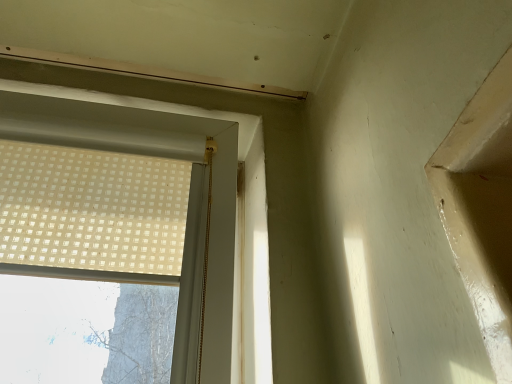
The height and width of the screenshot is (384, 512). What are the coordinates of `translucent plastic window at upper left` in the screenshot? It's located at (147, 155).

What do you see at coordinates (147, 155) in the screenshot? The image size is (512, 384). I see `translucent plastic window at upper left` at bounding box center [147, 155].

You are a GUI agent. You are given a task and a screenshot of the screen. Output one action in this format:
    pyautogui.click(x=<x>, y=<y>)
    Task: Click on the translucent plastic window at upper left
    The height and width of the screenshot is (384, 512).
    Given the screenshot: What is the action you would take?
    pyautogui.click(x=147, y=155)